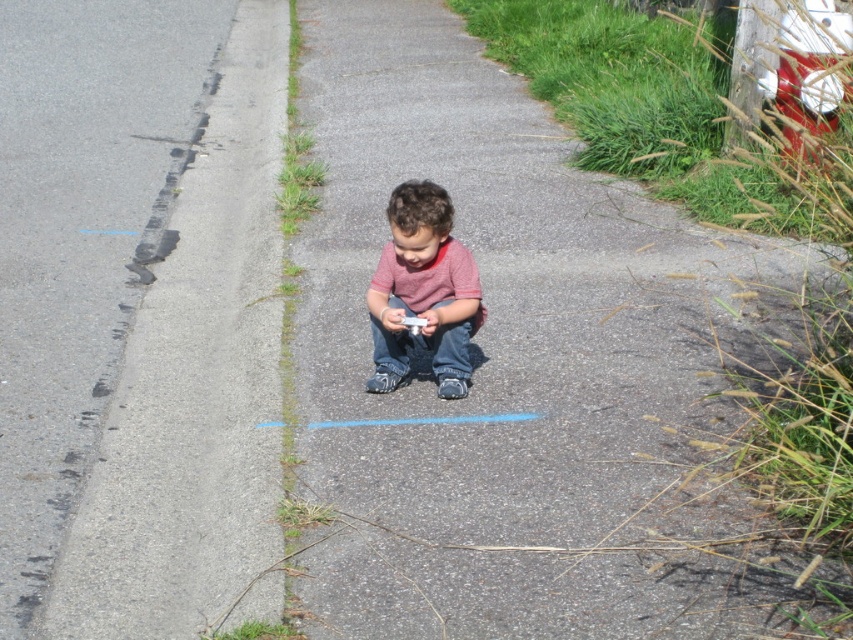
Which is more to the right, gray asphalt at lower left or matte pink shirt at center?

matte pink shirt at center

Which is in front, point (144, 627) or point (375, 353)?

Point (144, 627)

Which is behind, point (163, 392) or point (384, 372)?

The point (163, 392) is behind.

The image size is (853, 640). I want to click on gray asphalt at lower left, so click(x=192, y=385).

Looking at this image, can you confirm if gray asphalt pavement at center is positioned to the right of matte pink shirt at center?

Correct, you'll find gray asphalt pavement at center to the right of matte pink shirt at center.

Between gray asphalt pavement at center and matte pink shirt at center, which one is positioned lower?

matte pink shirt at center is lower down.

Who is more forward, (520, 179) or (477, 307)?

Point (477, 307) is more forward.

Find the location of a particular element. Image resolution: width=853 pixels, height=640 pixels. gray asphalt pavement at center is located at coordinates (521, 369).

Between gray asphalt pavement at center and gray asphalt at lower left, which one has more height?

gray asphalt at lower left

Does gray asphalt pavement at center have a smaller size compared to gray asphalt at lower left?

Incorrect, gray asphalt pavement at center is not smaller in size than gray asphalt at lower left.

Between point (402, 627) and point (109, 435), which one is positioned behind?

Positioned behind is point (109, 435).

This screenshot has height=640, width=853. In order to click on gray asphalt pavement at center in this screenshot , I will do `click(521, 369)`.